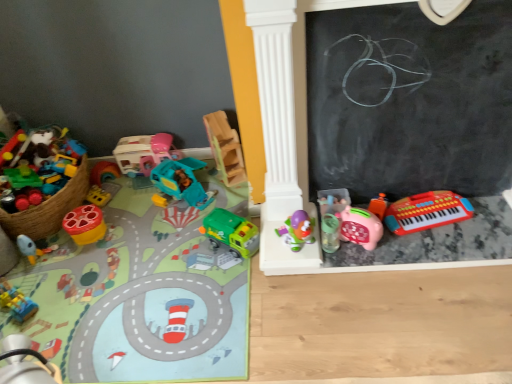
Where is `vacant point to the right of pink plastic piggy bank at lower right, placed as the 11th toy when sorted from left to right`? This screenshot has height=384, width=512. vacant point to the right of pink plastic piggy bank at lower right, placed as the 11th toy when sorted from left to right is located at coordinates (413, 244).